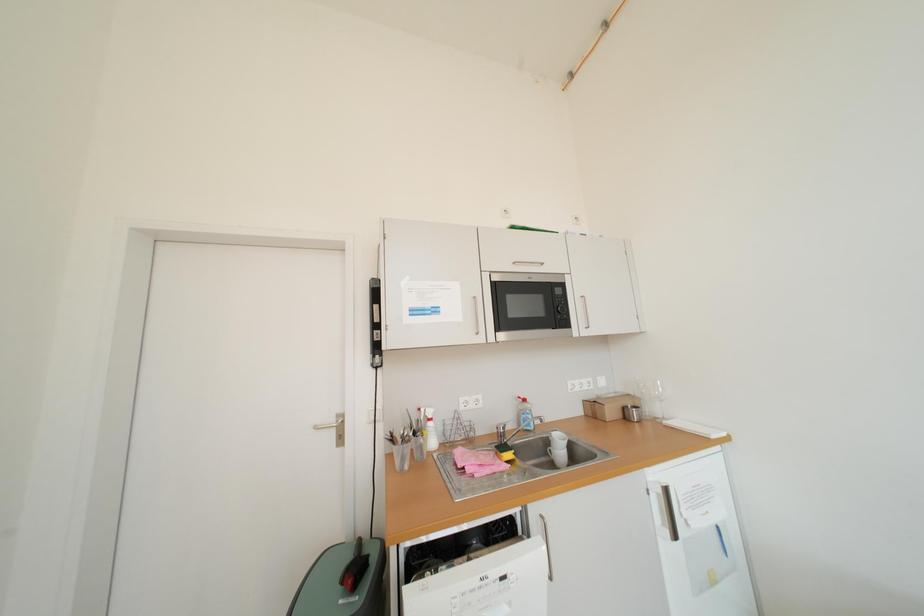
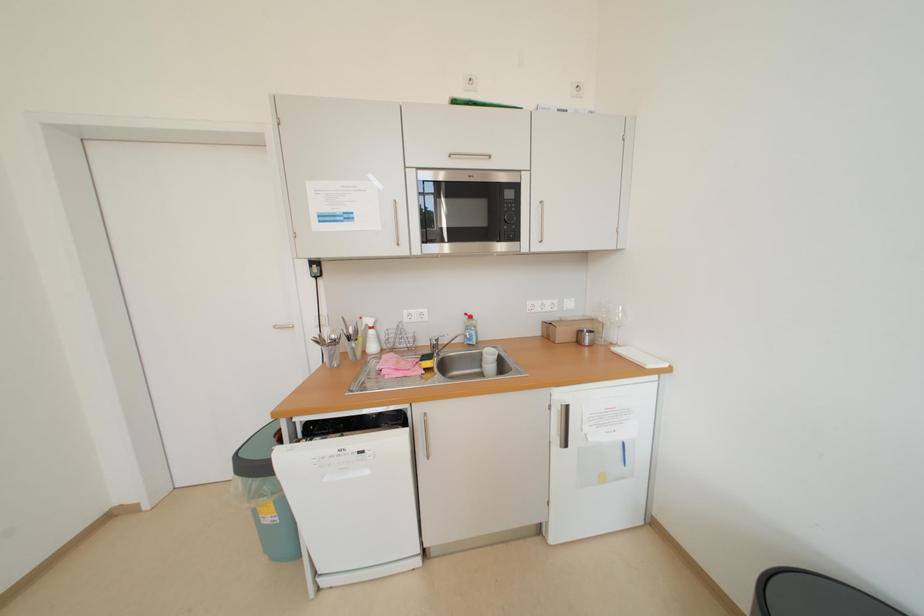
Question: What movement of the cameraman would produce the second image?

Choices:
 (A) Left
 (B) Right
 (C) Forward
 (D) Backward

Answer: (B)